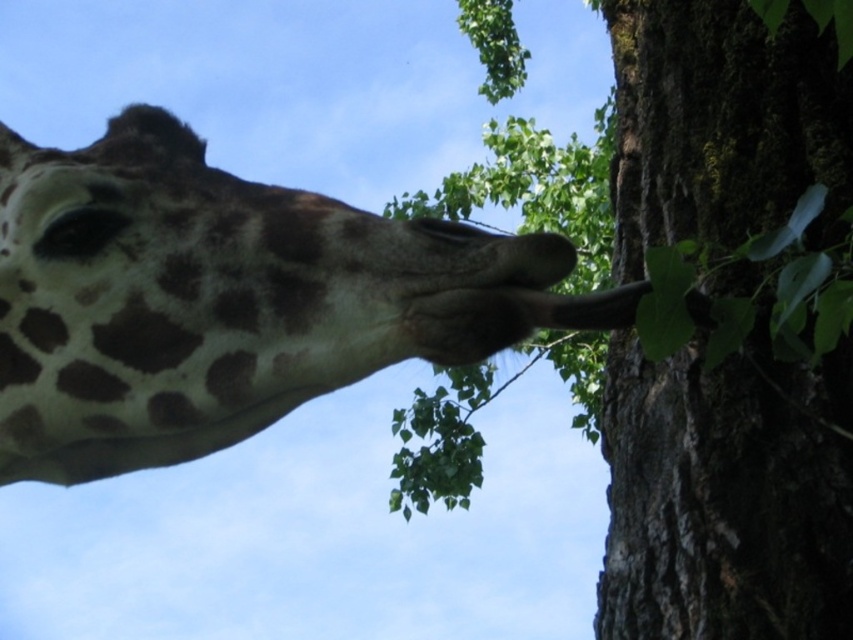
Between spotted fur at upper left and green mossy bark at upper right, which one appears on the left side from the viewer's perspective?

spotted fur at upper left is more to the left.

Is spotted fur at upper left taller than green mossy bark at upper right?

Incorrect, spotted fur at upper left's height is not larger of green mossy bark at upper right's.

Locate an element on the screen. spotted fur at upper left is located at coordinates (213, 300).